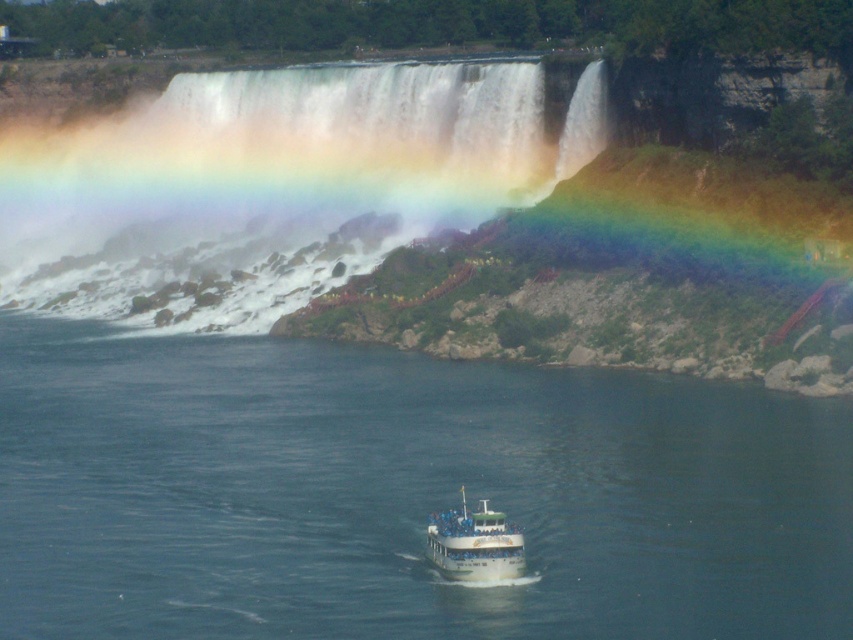
Does clear blue water at center appear under white misty waterfall at upper center?

Yes.

Looking at this image, is clear blue water at center wider than white misty waterfall at upper center?

No.

Between point (397, 492) and point (387, 243), which one is positioned behind?

The point (387, 243) is more distant.

The height and width of the screenshot is (640, 853). Find the location of `clear blue water at center`. clear blue water at center is located at coordinates (402, 493).

What do you see at coordinates (402, 493) in the screenshot? I see `clear blue water at center` at bounding box center [402, 493].

Measure the distance between clear blue water at center and white glossy boat at center.

The distance of clear blue water at center from white glossy boat at center is 45.77 feet.

Which is in front, point (668, 508) or point (521, 561)?

Point (521, 561) is more forward.

Find the location of a particular element. This screenshot has width=853, height=640. clear blue water at center is located at coordinates (402, 493).

Is white misty waterfall at upper center positioned behind white glossy boat at center?

Yes, white misty waterfall at upper center is further from the viewer.

Image resolution: width=853 pixels, height=640 pixels. Find the location of `white misty waterfall at upper center`. white misty waterfall at upper center is located at coordinates (279, 180).